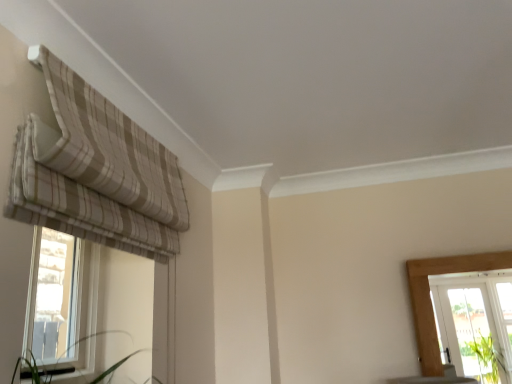
Question: In the image, is beige striped fabric at upper left on the left side or the right side of clear glass window at left?

Choices:
 (A) left
 (B) right

Answer: (B)

Question: Is beige striped fabric at upper left inside the boundaries of clear glass window at left, or outside?

Choices:
 (A) outside
 (B) inside

Answer: (A)

Question: Relative to clear glass window at left, is beige striped fabric at upper left in front or behind?

Choices:
 (A) front
 (B) behind

Answer: (A)

Question: Considering their positions, is clear glass window at left located in front of or behind beige striped fabric at upper left?

Choices:
 (A) behind
 (B) front

Answer: (A)

Question: From the image's perspective, is clear glass window at left above or below beige striped fabric at upper left?

Choices:
 (A) above
 (B) below

Answer: (B)

Question: Is point pyautogui.click(x=135, y=266) closer or farther from the camera than point pyautogui.click(x=31, y=175)?

Choices:
 (A) farther
 (B) closer

Answer: (A)

Question: From a real-world perspective, is clear glass window at left positioned above or below beige striped fabric at upper left?

Choices:
 (A) above
 (B) below

Answer: (B)